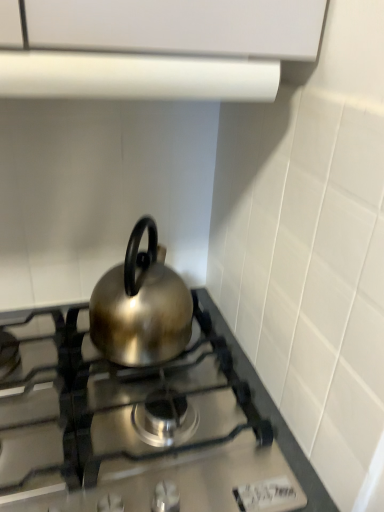
Question: From the image's perspective, would you say satin silver kettle at center is positioned over shiny metallic kettle at center?

Choices:
 (A) yes
 (B) no

Answer: (B)

Question: Would you say satin silver kettle at center is outside shiny metallic kettle at center?

Choices:
 (A) yes
 (B) no

Answer: (A)

Question: From a real-world perspective, is satin silver kettle at center positioned under shiny metallic kettle at center based on gravity?

Choices:
 (A) yes
 (B) no

Answer: (A)

Question: Could you tell me if satin silver kettle at center is turned towards shiny metallic kettle at center?

Choices:
 (A) yes
 (B) no

Answer: (B)

Question: Is satin silver kettle at center wider than shiny metallic kettle at center?

Choices:
 (A) yes
 (B) no

Answer: (A)

Question: Would you say shiny metallic kettle at center is inside or outside satin silver kettle at center?

Choices:
 (A) inside
 (B) outside

Answer: (B)

Question: Would you say shiny metallic kettle at center is to the left or to the right of satin silver kettle at center in the picture?

Choices:
 (A) left
 (B) right

Answer: (B)

Question: From the image's perspective, is shiny metallic kettle at center above or below satin silver kettle at center?

Choices:
 (A) above
 (B) below

Answer: (A)

Question: From a real-world perspective, relative to satin silver kettle at center, is shiny metallic kettle at center vertically above or below?

Choices:
 (A) below
 (B) above

Answer: (B)

Question: From the image's perspective, is shiny metallic kettle at center positioned above or below white matte vent at upper center?

Choices:
 (A) below
 (B) above

Answer: (A)

Question: From a real-world perspective, relative to white matte vent at upper center, is shiny metallic kettle at center vertically above or below?

Choices:
 (A) below
 (B) above

Answer: (A)

Question: Is point (150, 268) positioned closer to the camera than point (228, 20)?

Choices:
 (A) farther
 (B) closer

Answer: (A)

Question: Is shiny metallic kettle at center situated inside white matte vent at upper center or outside?

Choices:
 (A) outside
 (B) inside

Answer: (A)

Question: Is point (226, 434) positioned closer to the camera than point (96, 53)?

Choices:
 (A) farther
 (B) closer

Answer: (A)

Question: From the image's perspective, is satin silver kettle at center located above or below white matte vent at upper center?

Choices:
 (A) below
 (B) above

Answer: (A)